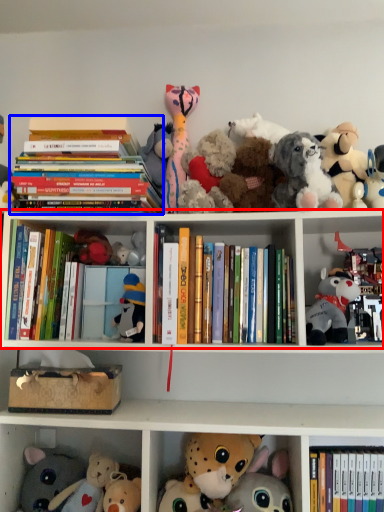
Question: Which object is further to the camera taking this photo, shelf (highlighted by a red box) or book (highlighted by a blue box)?

Choices:
 (A) shelf
 (B) book

Answer: (B)